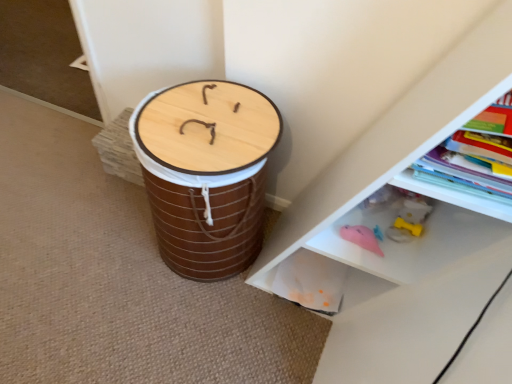
Question: Is the depth of white plastic shelf at lower right less than that of hardcover book at upper right?

Choices:
 (A) no
 (B) yes

Answer: (B)

Question: Is white plastic shelf at lower right to the right of hardcover book at upper right from the viewer's perspective?

Choices:
 (A) no
 (B) yes

Answer: (A)

Question: Can you confirm if white plastic shelf at lower right is taller than hardcover book at upper right?

Choices:
 (A) yes
 (B) no

Answer: (A)

Question: Can you confirm if white plastic shelf at lower right is bigger than hardcover book at upper right?

Choices:
 (A) no
 (B) yes

Answer: (B)

Question: Can you confirm if white plastic shelf at lower right is shorter than hardcover book at upper right?

Choices:
 (A) no
 (B) yes

Answer: (A)

Question: Considering the relative positions of white plastic shelf at lower right and hardcover book at upper right in the image provided, is white plastic shelf at lower right to the left of hardcover book at upper right from the viewer's perspective?

Choices:
 (A) yes
 (B) no

Answer: (A)

Question: Does hardcover book at upper right appear on the right side of wooden drum at center?

Choices:
 (A) no
 (B) yes

Answer: (B)

Question: Considering the relative sizes of hardcover book at upper right and wooden drum at center in the image provided, is hardcover book at upper right taller than wooden drum at center?

Choices:
 (A) yes
 (B) no

Answer: (B)

Question: Does hardcover book at upper right lie behind wooden drum at center?

Choices:
 (A) yes
 (B) no

Answer: (B)

Question: Can you confirm if hardcover book at upper right is bigger than wooden drum at center?

Choices:
 (A) no
 (B) yes

Answer: (A)

Question: From a real-world perspective, is hardcover book at upper right below wooden drum at center?

Choices:
 (A) no
 (B) yes

Answer: (A)

Question: Is hardcover book at upper right positioned with its back to wooden drum at center?

Choices:
 (A) yes
 (B) no

Answer: (B)

Question: Is wooden drum at center facing away from white plastic shelf at lower right?

Choices:
 (A) yes
 (B) no

Answer: (B)